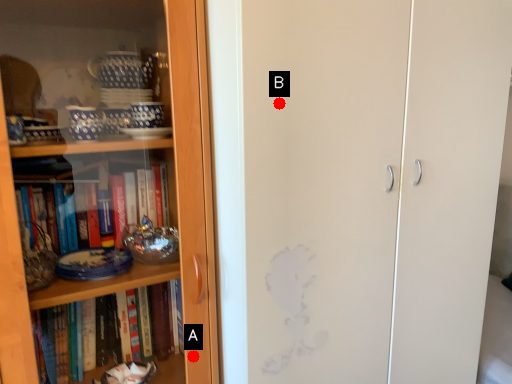
Question: Two points are circled on the image, labeled by A and B beside each circle. Which point is further to the camera?

Choices:
 (A) A is further
 (B) B is further

Answer: (A)